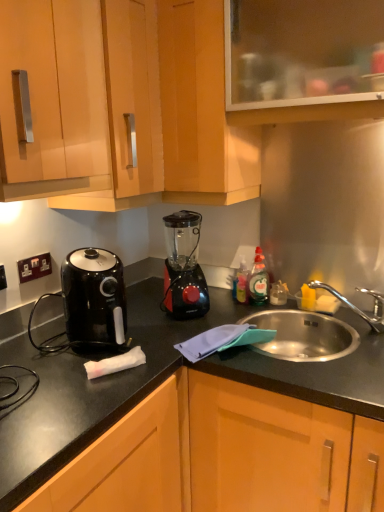
The height and width of the screenshot is (512, 384). Find the location of `vacant space underneath matte wood cabinet at upper left, which is the second cabinetry from bottom to top (from a real-world perspective)`. vacant space underneath matte wood cabinet at upper left, which is the second cabinetry from bottom to top (from a real-world perspective) is located at coordinates (137, 312).